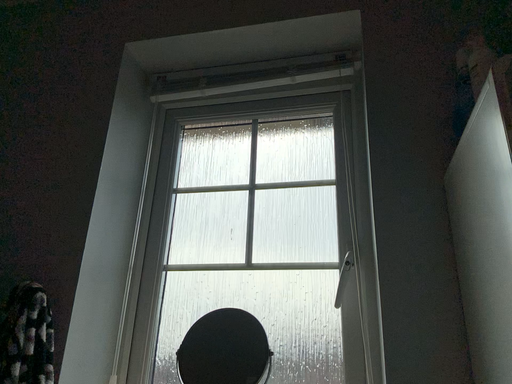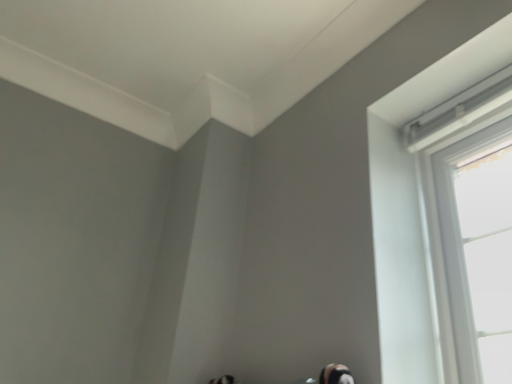
Question: How did the camera likely rotate when shooting the video?

Choices:
 (A) rotated left
 (B) rotated right

Answer: (A)